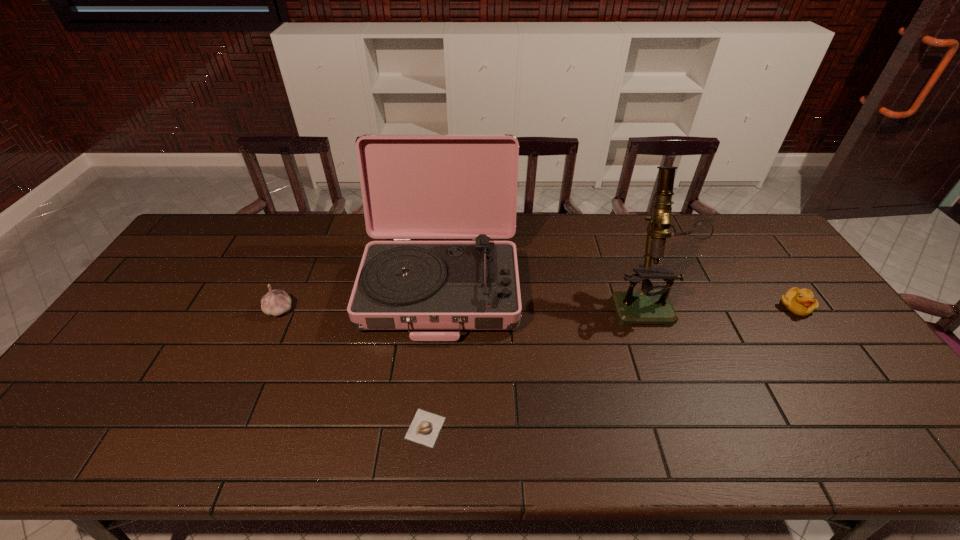
In the image, there is a desktop. Identify the location of vacant area at the near left corner. The image size is (960, 540). (35, 445).

The height and width of the screenshot is (540, 960). Find the location of `free space at the far right corner`. free space at the far right corner is located at coordinates (777, 253).

This screenshot has height=540, width=960. What are the coordinates of `vacant region between the microscope and the shortest object` in the screenshot? It's located at point(535,364).

Find the location of a particular element. free space between the fourth object from left to right and the nearer garlic is located at coordinates (535, 364).

The width and height of the screenshot is (960, 540). I want to click on vacant region between the microscope and the right garlic, so pyautogui.click(x=535, y=364).

At what (x,y) coordinates should I click in order to perform the action: click on free point between the record player and the nearest object. Please return your answer as a coordinate pair (x, y). Looking at the image, I should click on tap(433, 356).

Identify the location of free space that is in between the microscope and the record player. (542, 292).

Where is `vacant space that is in between the microscope and the right garlic`? vacant space that is in between the microscope and the right garlic is located at coordinates point(535,364).

The image size is (960, 540). Identify the location of the closest object to the rightmost object. (652, 305).

This screenshot has width=960, height=540. I want to click on the fourth closest object relative to the record player, so click(x=801, y=302).